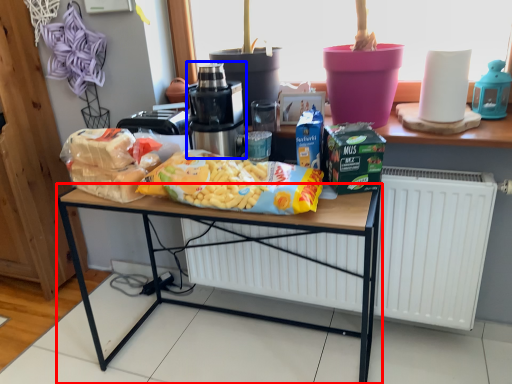
Question: Which point is further to the camera, desk (highlighted by a red box) or home appliance (highlighted by a blue box)?

Choices:
 (A) desk
 (B) home appliance

Answer: (B)